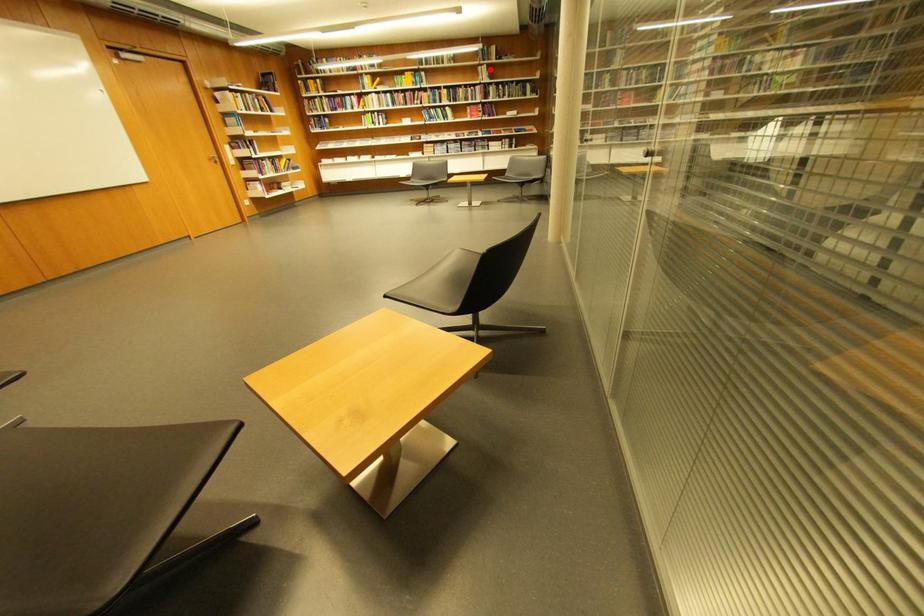
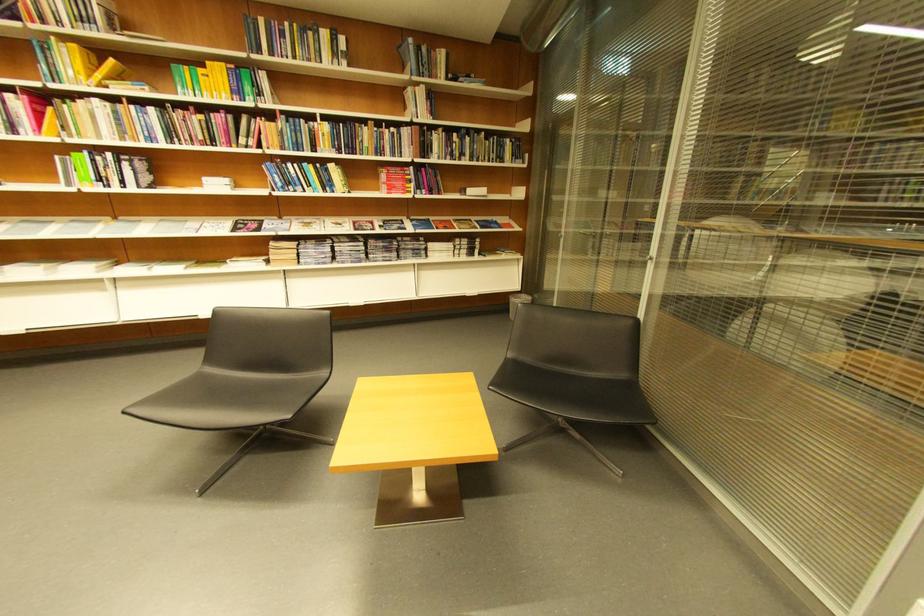
Where in the second image is the point corresponding to the highlighted location from the first image?

(419, 91)